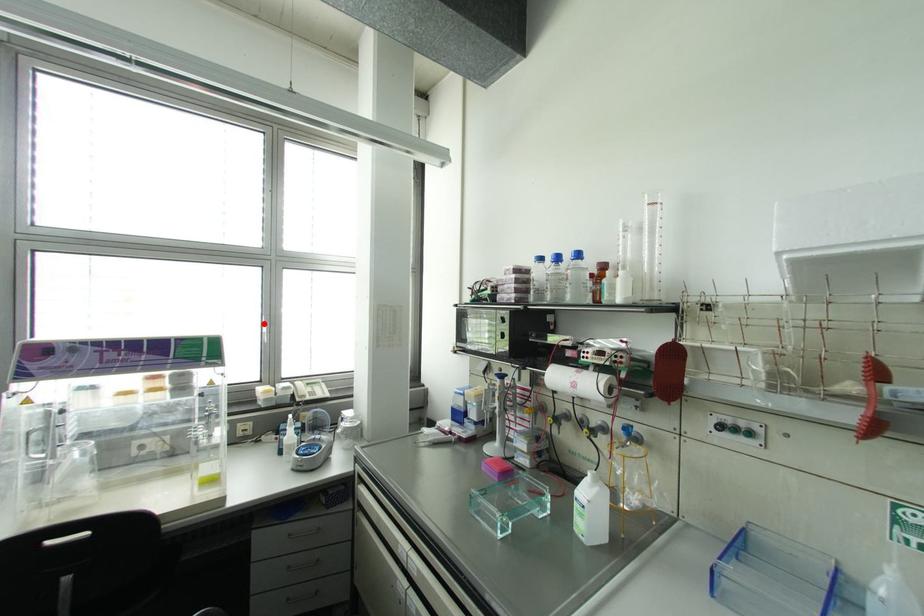
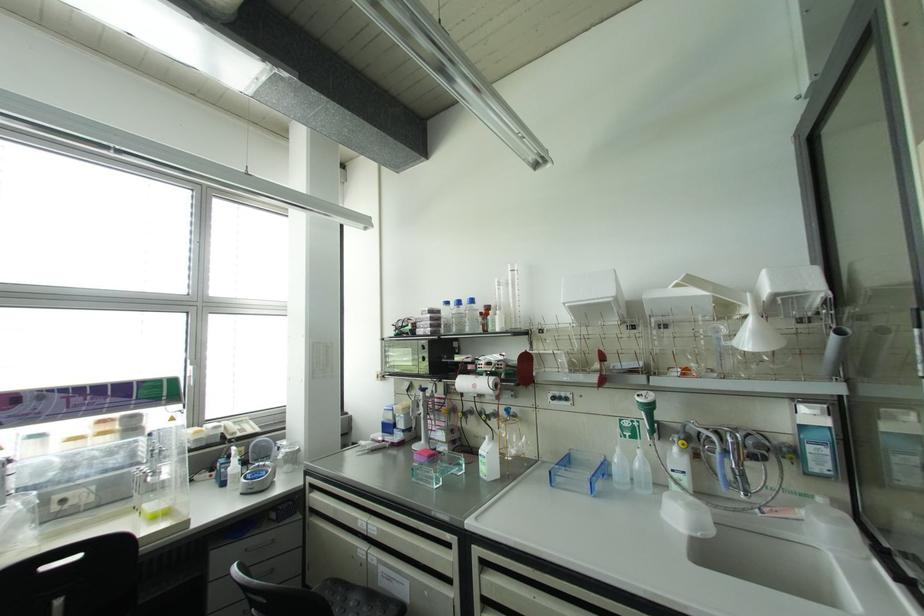
Question: I am providing you with two images of the same scene from different viewpoints. A red point is marked on the first image. At the location where the point appears in image 1, is it still visible in image 2?

Choices:
 (A) Yes
 (B) No

Answer: (A)